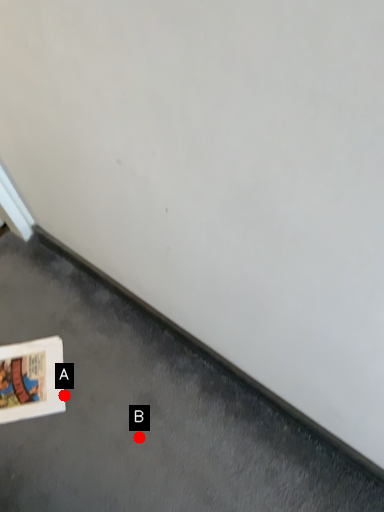
Question: Two points are circled on the image, labeled by A and B beside each circle. Among these points, which one is nearest to the camera?

Choices:
 (A) A is closer
 (B) B is closer

Answer: (B)